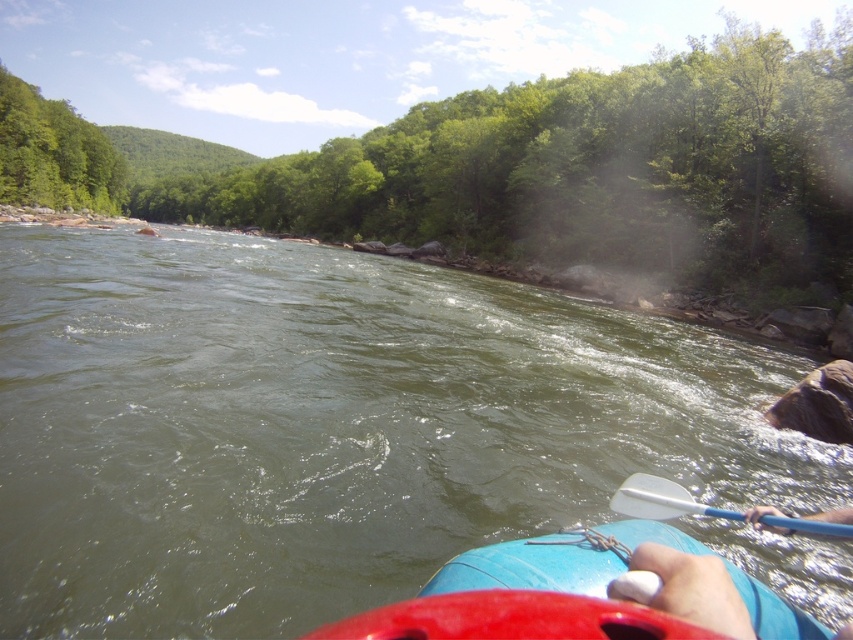
Is green rubber raft at center below blue rubber canoe at lower center?

No, green rubber raft at center is not below blue rubber canoe at lower center.

This screenshot has width=853, height=640. I want to click on green rubber raft at center, so click(331, 428).

Between point (61, 205) and point (677, 512), which one is positioned in front?

Point (677, 512) is more forward.

Which is behind, point (96, 161) or point (624, 481)?

Positioned behind is point (96, 161).

You are a GUI agent. You are given a task and a screenshot of the screen. Output one action in this format:
    pyautogui.click(x=<x>, y=<y>)
    Task: Click on the green leafy tree at upper left
    This screenshot has width=853, height=640.
    Given the screenshot: What is the action you would take?
    pyautogui.click(x=54, y=154)

Is green leafy tree at upper center bigger than green leafy tree at upper left?

Correct, green leafy tree at upper center is larger in size than green leafy tree at upper left.

Can you confirm if green leafy tree at upper center is thinner than green leafy tree at upper left?

No.

Is point (763, 188) in front of point (119, 205)?

Yes, it is.

This screenshot has width=853, height=640. I want to click on green leafy tree at upper center, so click(x=596, y=168).